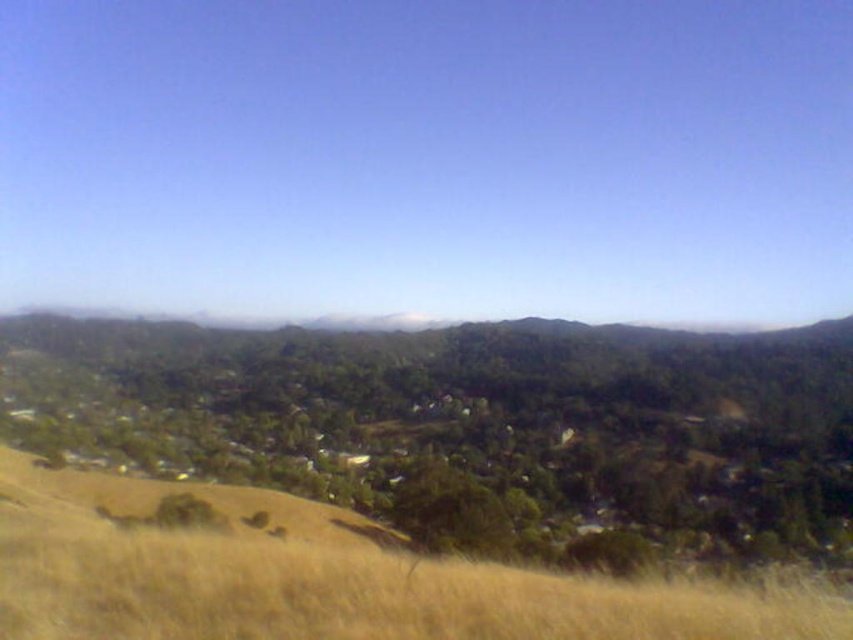
Describe the element at coordinates (323, 577) in the screenshot. I see `dry grass at lower center` at that location.

You are a GUI agent. You are given a task and a screenshot of the screen. Output one action in this format:
    pyautogui.click(x=<x>, y=<y>)
    Task: Click on the dry grass at lower center
    The height and width of the screenshot is (640, 853).
    Given the screenshot: What is the action you would take?
    pyautogui.click(x=323, y=577)

Find the location of `dry grass at lower center`. dry grass at lower center is located at coordinates (323, 577).